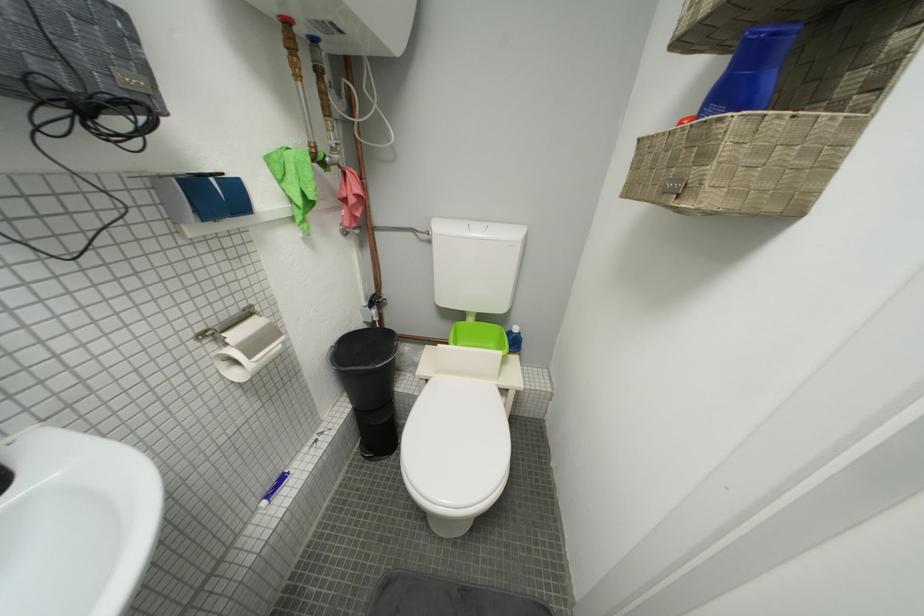
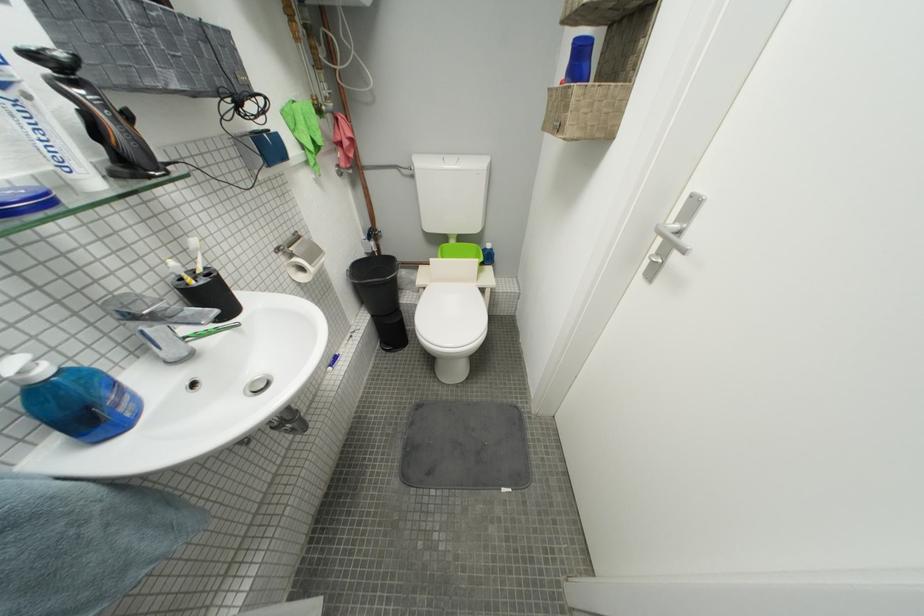
In the second image, find the point that corresponds to point 259,359 in the first image.

(320, 265)